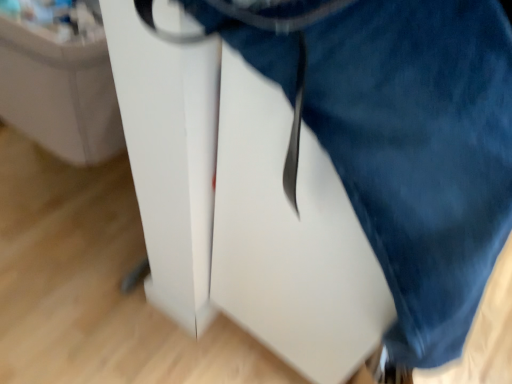
Image resolution: width=512 pixels, height=384 pixels. I want to click on denim trousers at center, so click(420, 152).

What do you see at coordinates (420, 152) in the screenshot? The image size is (512, 384). I see `denim trousers at center` at bounding box center [420, 152].

At what (x,y) coordinates should I click in order to perform the action: click on denim trousers at center. Please return your answer as a coordinate pair (x, y). This screenshot has width=512, height=384. Looking at the image, I should click on (420, 152).